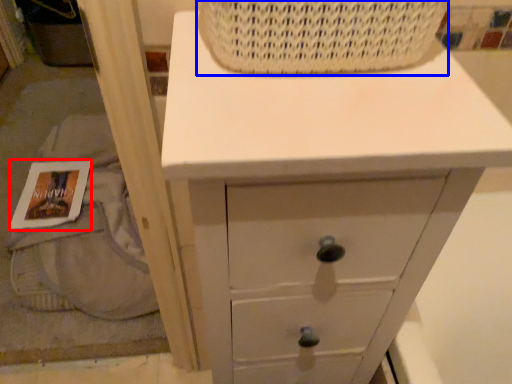
Question: Which object appears farthest to the camera in this image, magazine (highlighted by a red box) or basket (highlighted by a blue box)?

Choices:
 (A) magazine
 (B) basket

Answer: (A)